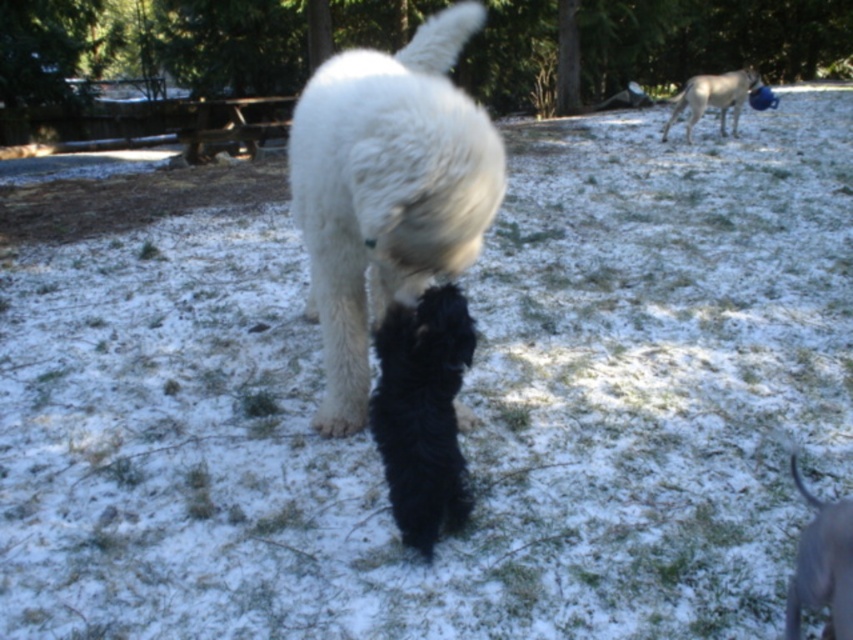
You are standing at the point with coordinates point (839, 536) and want to walk to the point (726, 86). Which direction should you move to reach your destination?

You should move backward because point (839, 536) is in front of point (726, 86).

You are a photographer trying to capture the black silky fur at lower right and the white fur dog at upper right in the same frame. Based on their heights, which one would appear closer to the bottom of the photo?

The black silky fur at lower right has a lesser height compared to the white fur dog at upper right, so it would appear closer to the bottom of the photo.